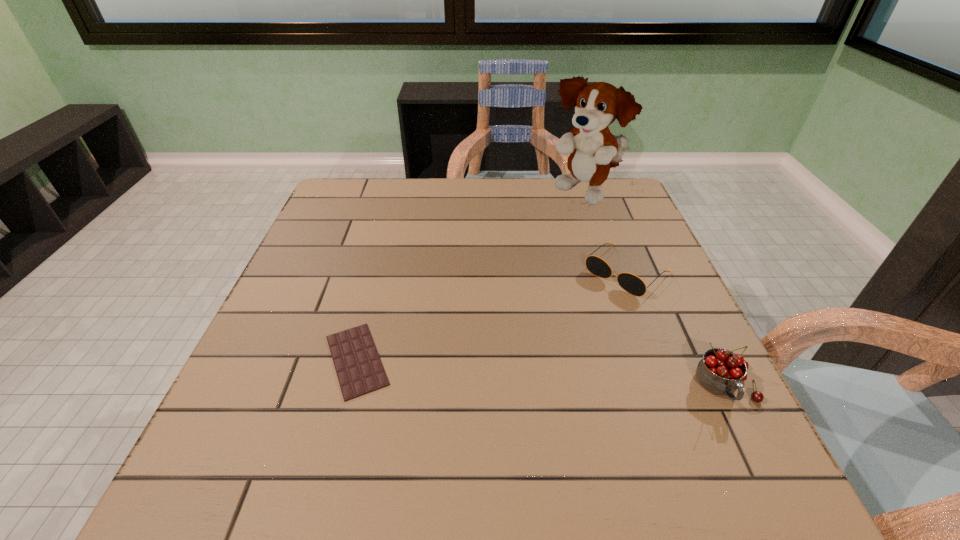
You are a GUI agent. You are given a task and a screenshot of the screen. Output one action in this format:
    pyautogui.click(x=<x>, y=<y>)
    Task: Click on the vacant space at the near right corner of the desktop
    The image size is (960, 540).
    Given the screenshot: What is the action you would take?
    pyautogui.click(x=644, y=397)

I want to click on free space between the third shortest object and the tallest object, so click(x=657, y=292).

This screenshot has height=540, width=960. In order to click on free spot between the tallest object and the second farthest object in this screenshot , I will do `click(606, 234)`.

You are a GUI agent. You are given a task and a screenshot of the screen. Output one action in this format:
    pyautogui.click(x=<x>, y=<y>)
    Task: Click on the free space between the second farthest object and the tallest object
    Image resolution: width=960 pixels, height=540 pixels.
    Given the screenshot: What is the action you would take?
    pyautogui.click(x=606, y=234)

Locate an element on the screen. Image resolution: width=960 pixels, height=540 pixels. vacant space that is in between the second tallest object and the puppy is located at coordinates coord(657,292).

At what (x,y) coordinates should I click in order to perform the action: click on free spot between the tallest object and the second farthest object. Please return your answer as a coordinate pair (x, y). This screenshot has height=540, width=960. Looking at the image, I should click on (606, 234).

Where is `unoccupied area between the shortest object and the tallest object`? This screenshot has height=540, width=960. unoccupied area between the shortest object and the tallest object is located at coordinates (471, 278).

Where is `vacant space that's between the chocolate bar and the second tallest object`? This screenshot has width=960, height=540. vacant space that's between the chocolate bar and the second tallest object is located at coordinates (541, 374).

The height and width of the screenshot is (540, 960). I want to click on free area in between the chocolate bar and the third shortest object, so (541, 374).

The image size is (960, 540). What are the coordinates of `unoccupied area between the farthest object and the third tallest object` in the screenshot? It's located at 606,234.